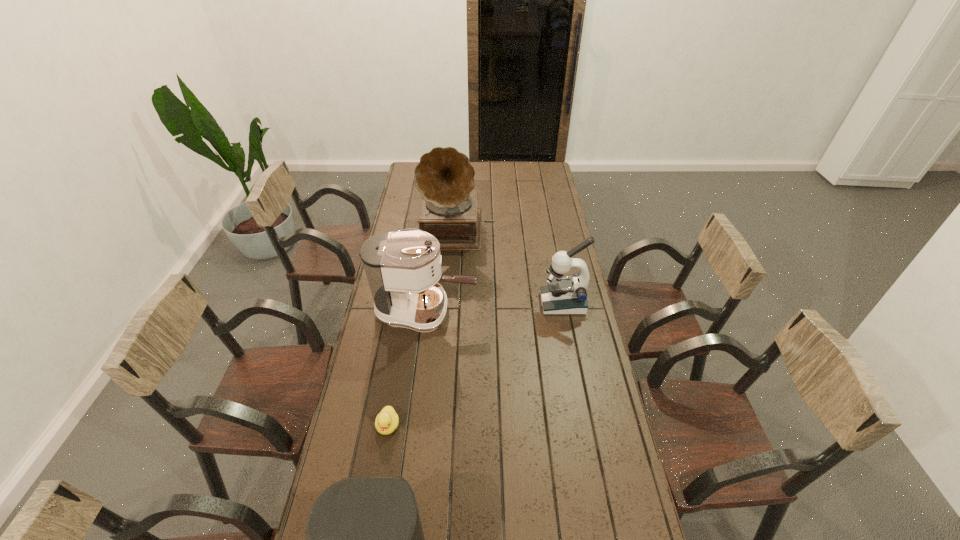
The width and height of the screenshot is (960, 540). In order to click on free region located at the eyepiece of the microscope in this screenshot , I will do coord(451,303).

Where is `free region located on the beak of the shortest object`? This screenshot has height=540, width=960. free region located on the beak of the shortest object is located at coordinates (378, 483).

This screenshot has height=540, width=960. I want to click on record player that is at the left edge, so click(444, 176).

The image size is (960, 540). In order to click on coffee maker at the left edge in this screenshot , I will do `click(402, 268)`.

The height and width of the screenshot is (540, 960). Find the location of `duckling that is at the left edge`. duckling that is at the left edge is located at coordinates (387, 420).

You are a GUI agent. You are given a task and a screenshot of the screen. Output one action in this format:
    pyautogui.click(x=<x>, y=<y>)
    Task: Click on the object that is at the right edge
    
    Given the screenshot: What is the action you would take?
    pyautogui.click(x=563, y=295)

Locate an element on the screen. The image size is (960, 540). vacant space at the far edge of the desktop is located at coordinates (495, 170).

The height and width of the screenshot is (540, 960). In the image, there is a desktop. Identify the location of vacant space at the left edge. (408, 201).

In the image, there is a desktop. At what (x,y) coordinates should I click in order to perform the action: click on vacant space at the right edge. Please return your answer as a coordinate pair (x, y). The width and height of the screenshot is (960, 540). Looking at the image, I should click on (559, 219).

At what (x,y) coordinates should I click in order to perform the action: click on free space between the rightmost object and the fourth farthest object. Please return your answer as a coordinate pair (x, y). The height and width of the screenshot is (540, 960). Looking at the image, I should click on (475, 364).